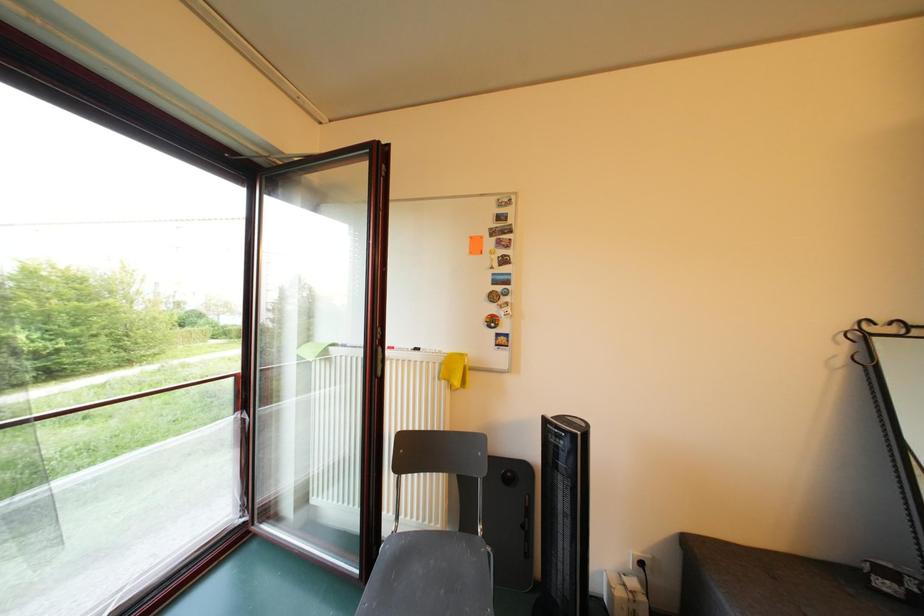
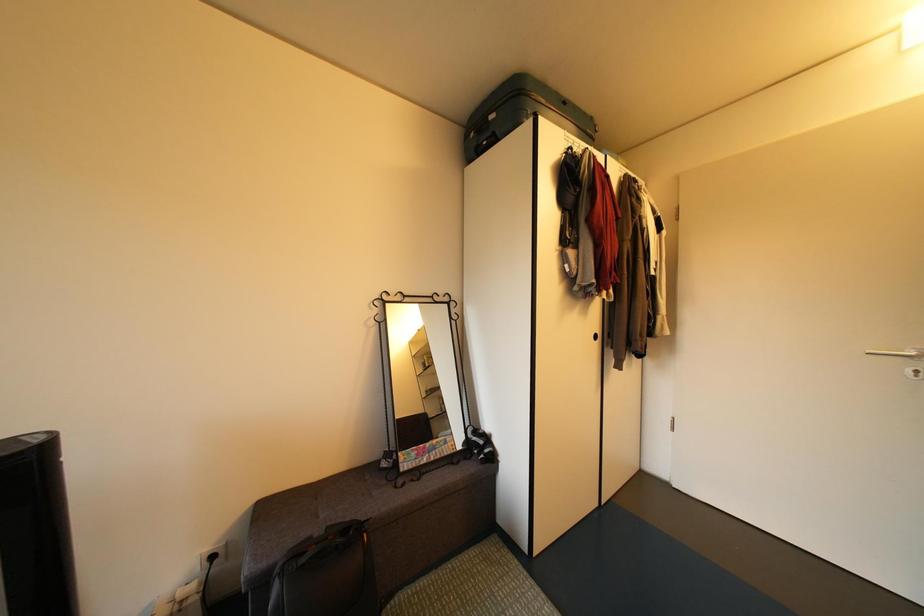
Question: The images are taken continuously from a first-person perspective. In which direction is your viewpoint rotating?

Choices:
 (A) Left
 (B) Right
 (C) Up
 (D) Down

Answer: (B)